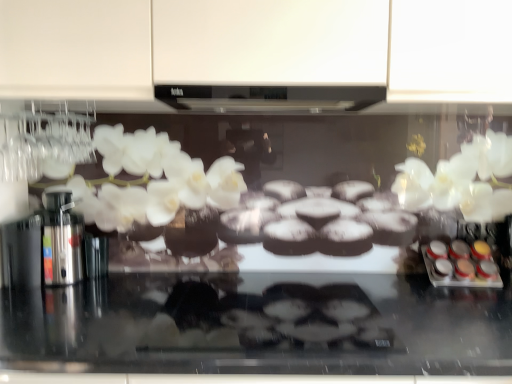
Question: Is point tap(480, 268) positioned closer to the camera than point tap(245, 92)?

Choices:
 (A) closer
 (B) farther

Answer: (B)

Question: Considering their positions, is metallic silver spice containers at right located in front of or behind black matte exhaust hood at center?

Choices:
 (A) behind
 (B) front

Answer: (A)

Question: Would you say metallic silver spice containers at right is inside or outside black matte exhaust hood at center?

Choices:
 (A) inside
 (B) outside

Answer: (B)

Question: Considering the positions of black matte exhaust hood at center and metallic silver spice containers at right in the image, is black matte exhaust hood at center bigger or smaller than metallic silver spice containers at right?

Choices:
 (A) big
 (B) small

Answer: (A)

Question: Choose the correct answer: Is black matte exhaust hood at center inside metallic silver spice containers at right or outside it?

Choices:
 (A) inside
 (B) outside

Answer: (B)

Question: Considering the positions of point (352, 105) and point (476, 244), is point (352, 105) closer or farther from the camera than point (476, 244)?

Choices:
 (A) farther
 (B) closer

Answer: (B)

Question: In terms of width, does black matte exhaust hood at center look wider or thinner when compared to metallic silver spice containers at right?

Choices:
 (A) thin
 (B) wide

Answer: (B)